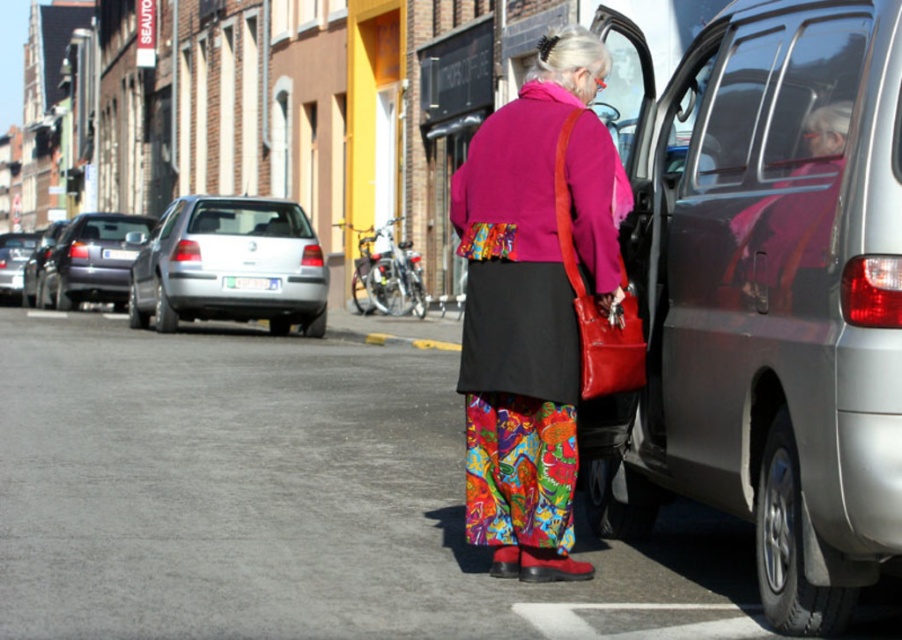
You are a delivery driver who needs to park your vehicle in this street scene. The parking spot you want is directly in front of the yellow storefront. There is a silver metallic car at left blocking the path. Can you maneuver around it to access the parking spot?

The silver metallic car at left is located at point (229,266), which is to the left side of the scene. Since the parking spot is directly in front of the yellow storefront, you can maneuver around the silver metallic car at left by moving to the right side of it to access the parking spot.

You are a pedestrian standing at the center of the street. You see a silver metallic car at left and a metallic gray van at right. Which vehicle is closer to the ground?

The silver metallic car at left is closer to the ground because it is positioned below the metallic gray van at right.